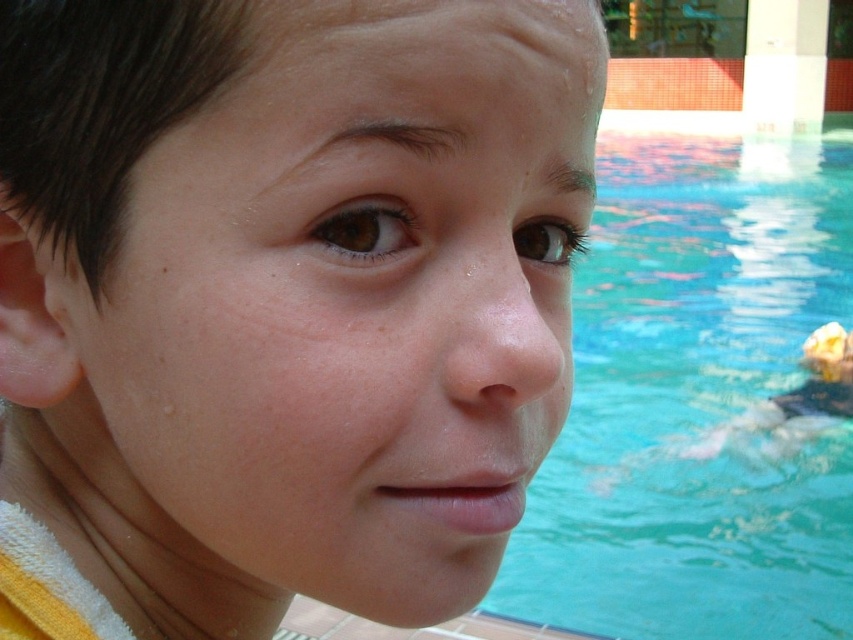
You are a dermatologist analyzing a closeup of a person face with short dark hair and freckles. You observe the dry skin at center. Where exactly is the dry skin located on the face?

The dry skin at center is located at the coordinates point [344,314].

Based on the scene described, which object is closer to the observer between the dry skin at center and the blue water at center?

The dry skin at center is closer to the observer because it is in front of the blue water at center according to the description.

You are a lifeguard standing at the edge of the pool. You notice the dry skin at center and the blue water at center. How far apart are these two points from each other?

The dry skin at center is 2.34 meters away from the blue water at center.